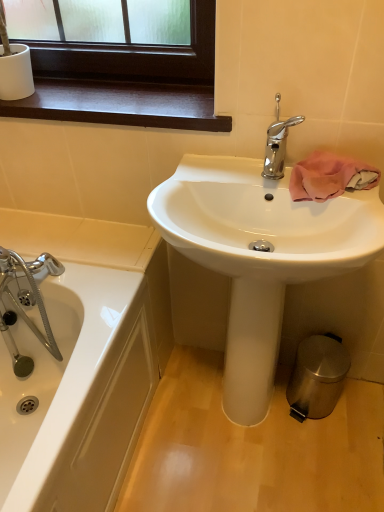
Where is `free spot to the left of polished chrome faucet at upper center`? This screenshot has width=384, height=512. free spot to the left of polished chrome faucet at upper center is located at coordinates (214, 176).